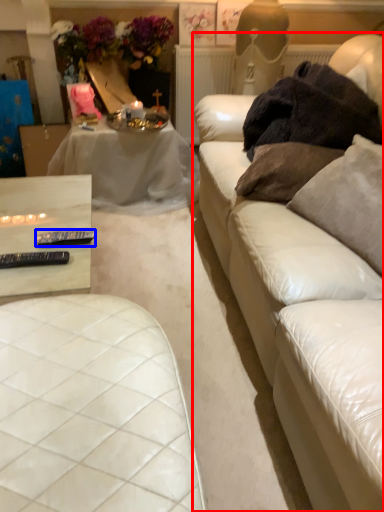
Question: Which of the following is the closest to the observer, studio couch (highlighted by a red box) or tableware (highlighted by a blue box)?

Choices:
 (A) studio couch
 (B) tableware

Answer: (A)